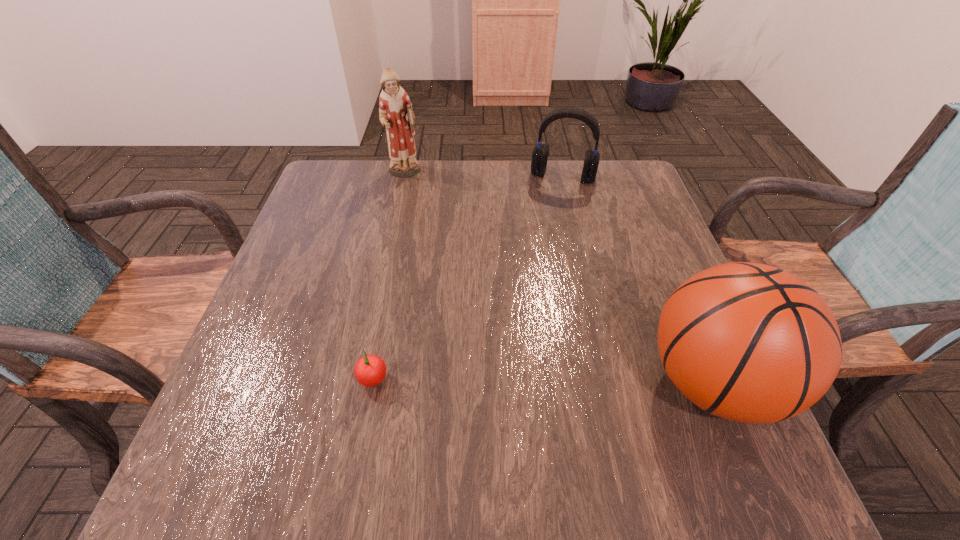
Find the location of a particular element. The width and height of the screenshot is (960, 540). vacant space located 0.080m on the front-facing side of the figurine is located at coordinates (417, 197).

The width and height of the screenshot is (960, 540). I want to click on vacant space located on the front-facing side of the figurine, so click(x=429, y=222).

Where is `headset at the far edge`? headset at the far edge is located at coordinates (540, 153).

Find the location of `figurine at the far edge`. figurine at the far edge is located at coordinates (395, 109).

Where is `cherry that is at the near edge`? Image resolution: width=960 pixels, height=540 pixels. cherry that is at the near edge is located at coordinates (370, 370).

Where is `basketball located in the near edge section of the desktop`? basketball located in the near edge section of the desktop is located at coordinates (748, 342).

Locate an element on the screen. The image size is (960, 540). basketball that is at the right edge is located at coordinates (748, 342).

Where is `headset that is at the right edge`? The height and width of the screenshot is (540, 960). headset that is at the right edge is located at coordinates (540, 153).

Locate an element on the screen. The height and width of the screenshot is (540, 960). object located in the far right corner section of the desktop is located at coordinates (540, 153).

Locate an element on the screen. The height and width of the screenshot is (540, 960). object that is at the near right corner is located at coordinates (748, 342).